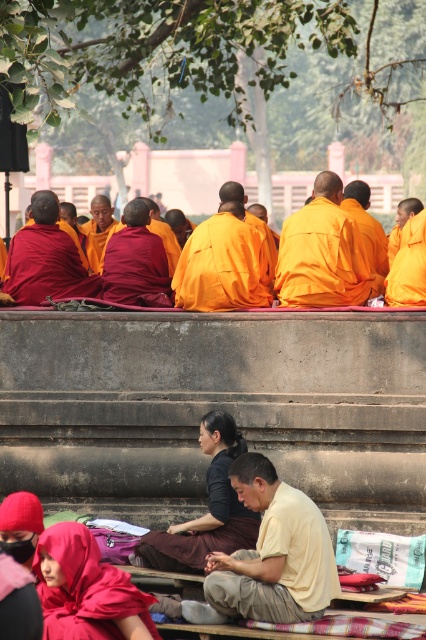
Question: Does orange clothed monk at center lie behind orange robe monk at center?

Choices:
 (A) no
 (B) yes

Answer: (A)

Question: Which point is farther to the camera?

Choices:
 (A) (402, 241)
 (B) (380, 244)
 (C) (322, 570)
 (D) (232, 529)

Answer: (B)

Question: Does orange matte robe at center appear on the left side of orange robe monk at center?

Choices:
 (A) no
 (B) yes

Answer: (A)

Question: Is yellow matte shirt at center in front of orange robe monk at center?

Choices:
 (A) yes
 (B) no

Answer: (A)

Question: Among these objects, which one is farthest from the camera?

Choices:
 (A) orange clothed monk at center
 (B) matte red robe at lower left
 (C) orange cloth at center
 (D) orange cotton robe at lower center

Answer: (A)

Question: Which point is farther to the camera?

Choices:
 (A) orange matte robe at right
 (B) orange clothed monk at center
 (C) matte red robe at lower left

Answer: (B)